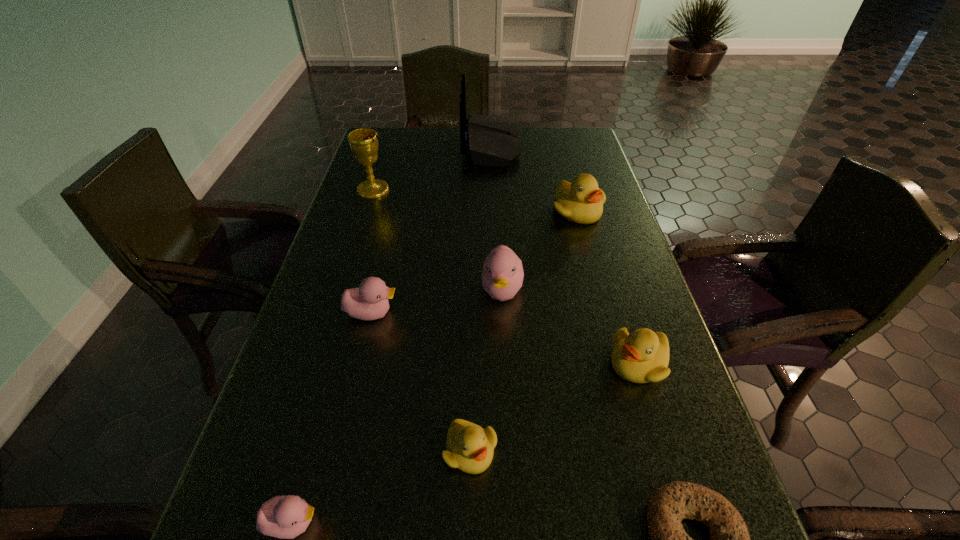
Identify the location of black router. (491, 141).

This screenshot has height=540, width=960. What are the coordinates of `router` in the screenshot? It's located at (491, 141).

Image resolution: width=960 pixels, height=540 pixels. In order to click on gold chalice in this screenshot , I will do `click(363, 142)`.

I want to click on the biggest pink duckling, so click(502, 276).

What are the coordinates of `the farthest yellow duckling` in the screenshot? It's located at (581, 201).

This screenshot has width=960, height=540. What are the coordinates of `the biggest yellow duckling` in the screenshot? It's located at (581, 201).

At what (x,y) coordinates should I click in order to perform the action: click on the second smallest pink duckling. Please return your answer as a coordinate pair (x, y). The image size is (960, 540). Looking at the image, I should click on (370, 301).

This screenshot has height=540, width=960. Find the location of `the second biggest yellow duckling`. the second biggest yellow duckling is located at coordinates (642, 356).

The width and height of the screenshot is (960, 540). In order to click on the sixth farthest object in this screenshot , I will do `click(642, 356)`.

The width and height of the screenshot is (960, 540). What are the coordinates of `the leftmost yellow duckling` in the screenshot? It's located at (470, 448).